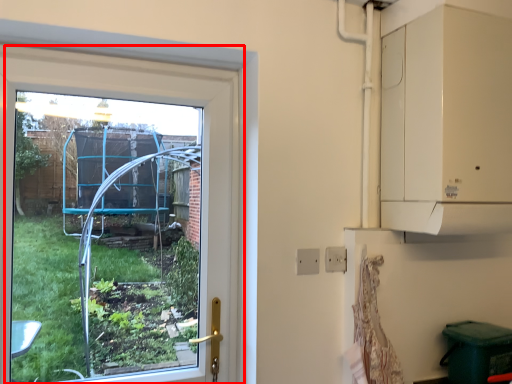
Question: From the image's perspective, considering the relative positions of window (annotated by the red box) and electric outlet in the image provided, where is window (annotated by the red box) located with respect to the staircase?

Choices:
 (A) above
 (B) below

Answer: (A)